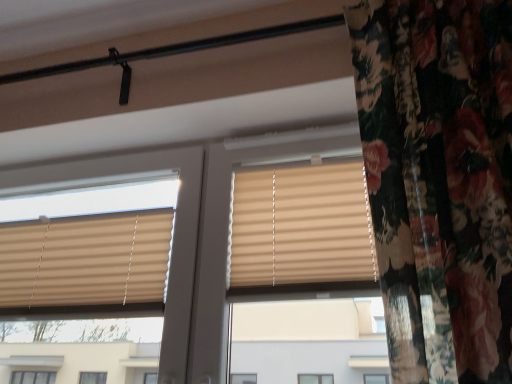
Locate an element on the screen. This screenshot has width=512, height=384. beige pleated blinds at upper left is located at coordinates (86, 260).

This screenshot has width=512, height=384. Describe the element at coordinates (86, 260) in the screenshot. I see `beige pleated blinds at upper left` at that location.

Identify the location of beige fabric blinds at center. This screenshot has width=512, height=384. (301, 226).

What do you see at coordinates (301, 226) in the screenshot? The image size is (512, 384). I see `beige fabric blinds at center` at bounding box center [301, 226].

The image size is (512, 384). In order to click on beige pleated blinds at upper left in this screenshot , I will do `click(86, 260)`.

Would you say beige fabric blinds at center is to the left or to the right of beige pleated blinds at upper left in the picture?

From the image, it's evident that beige fabric blinds at center is to the right of beige pleated blinds at upper left.

In the image, is beige fabric blinds at center positioned in front of or behind beige pleated blinds at upper left?

Clearly, beige fabric blinds at center is in front of beige pleated blinds at upper left.

Which is closer to the camera, (335, 231) or (145, 300)?

Clearly, point (335, 231) is closer to the camera than point (145, 300).

From the image's perspective, who appears lower, beige fabric blinds at center or beige pleated blinds at upper left?

beige pleated blinds at upper left.

From a real-world perspective, is beige fabric blinds at center physically above beige pleated blinds at upper left?

Yes, from a real-world perspective, beige fabric blinds at center is above beige pleated blinds at upper left.

Considering the relative sizes of beige fabric blinds at center and beige pleated blinds at upper left in the image provided, is beige fabric blinds at center wider than beige pleated blinds at upper left?

No.

Is beige fabric blinds at center shorter than beige pleated blinds at upper left?

No.

Considering the sizes of beige fabric blinds at center and beige pleated blinds at upper left in the image, is beige fabric blinds at center bigger or smaller than beige pleated blinds at upper left?

In the image, beige fabric blinds at center appears to be smaller than beige pleated blinds at upper left.

Is beige fabric blinds at center outside of beige pleated blinds at upper left?

beige fabric blinds at center lies outside beige pleated blinds at upper left's area.

Is beige fabric blinds at center in contact with beige pleated blinds at upper left?

No, beige fabric blinds at center is not with beige pleated blinds at upper left.

In the scene shown: Could you tell me if beige fabric blinds at center is facing beige pleated blinds at upper left?

No, beige fabric blinds at center is not facing towards beige pleated blinds at upper left.

What's the angular difference between beige fabric blinds at center and beige pleated blinds at upper left's facing directions?

There is a 4.7e-05-degree angle between the facing directions of beige fabric blinds at center and beige pleated blinds at upper left.

Where is `window blind located below the beige fabric blinds at center (from the image's perspective)`? Image resolution: width=512 pixels, height=384 pixels. window blind located below the beige fabric blinds at center (from the image's perspective) is located at coordinates (86, 260).

From the picture: Considering the relative positions of beige pleated blinds at upper left and beige fabric blinds at center in the image provided, is beige pleated blinds at upper left to the left or to the right of beige fabric blinds at center?

Based on their positions, beige pleated blinds at upper left is located to the left of beige fabric blinds at center.

Is beige pleated blinds at upper left positioned behind beige fabric blinds at center?

Yes, beige pleated blinds at upper left is further from the camera.

Is point (9, 242) positioned behind point (344, 171)?

That is True.

From the picture: From the image's perspective, is beige pleated blinds at upper left above beige fabric blinds at center?

No, from the image's perspective, beige pleated blinds at upper left is not on top of beige fabric blinds at center.

From a real-world perspective, is beige pleated blinds at upper left above or below beige fabric blinds at center?

beige pleated blinds at upper left is situated lower than beige fabric blinds at center in the real world.

Considering the sizes of beige pleated blinds at upper left and beige fabric blinds at center in the image, is beige pleated blinds at upper left wider or thinner than beige fabric blinds at center?

Clearly, beige pleated blinds at upper left has more width compared to beige fabric blinds at center.

Considering the relative sizes of beige pleated blinds at upper left and beige fabric blinds at center in the image provided, is beige pleated blinds at upper left taller than beige fabric blinds at center?

No, beige pleated blinds at upper left is not taller than beige fabric blinds at center.

Based on their sizes in the image, would you say beige pleated blinds at upper left is bigger or smaller than beige fabric blinds at center?

Clearly, beige pleated blinds at upper left is larger in size than beige fabric blinds at center.

In the scene shown: Is beige fabric blinds at center a part of beige pleated blinds at upper left?

No, beige fabric blinds at center is not surrounded by beige pleated blinds at upper left.

Can you see beige pleated blinds at upper left touching beige fabric blinds at center?

beige pleated blinds at upper left and beige fabric blinds at center are clearly separated.

Could you tell me if beige pleated blinds at upper left is facing beige fabric blinds at center?

No, beige pleated blinds at upper left is not aimed at beige fabric blinds at center.

What are the coordinates of `window blind lying on the left of beige fabric blinds at center` in the screenshot? It's located at (86, 260).

The image size is (512, 384). What are the coordinates of `window blind below the beige fabric blinds at center (from the image's perspective)` in the screenshot? It's located at (86, 260).

This screenshot has width=512, height=384. I want to click on window blind behind the beige fabric blinds at center, so click(x=86, y=260).